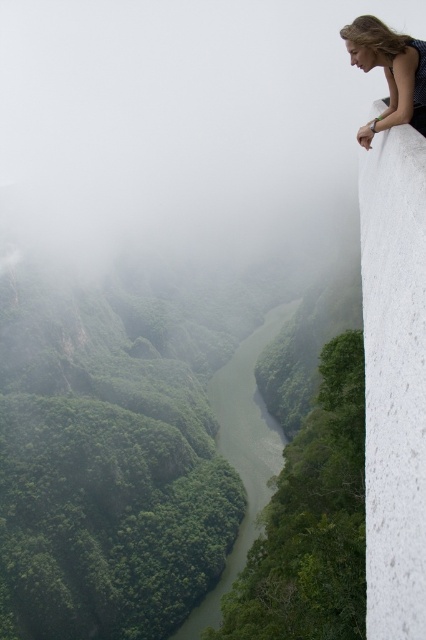
Who is shorter, white speckled concrete cliff at upper right or blue dotted dress at upper right?

Standing shorter between the two is blue dotted dress at upper right.

Is white speckled concrete cliff at upper right above blue dotted dress at upper right?

No, white speckled concrete cliff at upper right is not above blue dotted dress at upper right.

Locate an element on the screen. The height and width of the screenshot is (640, 426). white speckled concrete cliff at upper right is located at coordinates (394, 380).

Looking at this image, can you confirm if white speckled concrete cliff at upper right is positioned below green leafy river at center?

No.

Who is lower down, white speckled concrete cliff at upper right or green leafy river at center?

green leafy river at center is below.

Find the location of a particular element. The height and width of the screenshot is (640, 426). white speckled concrete cliff at upper right is located at coordinates (394, 380).

Identify the location of white speckled concrete cliff at upper right. (394, 380).

Is point (224, 403) positioned behind point (359, 131)?

Yes, point (224, 403) is behind point (359, 131).

Which is more to the right, green leafy river at center or blue dotted dress at upper right?

blue dotted dress at upper right is more to the right.

Locate an element on the screen. The height and width of the screenshot is (640, 426). green leafy river at center is located at coordinates (242, 452).